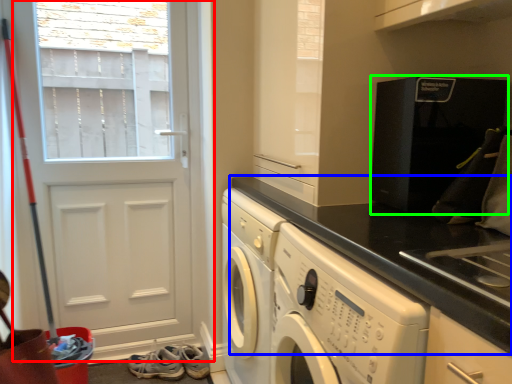
Question: Considering the real-world distances, which object is closest to door (highlighted by a red box)? countertop (highlighted by a blue box) or home appliance (highlighted by a green box).

Choices:
 (A) countertop
 (B) home appliance

Answer: (A)